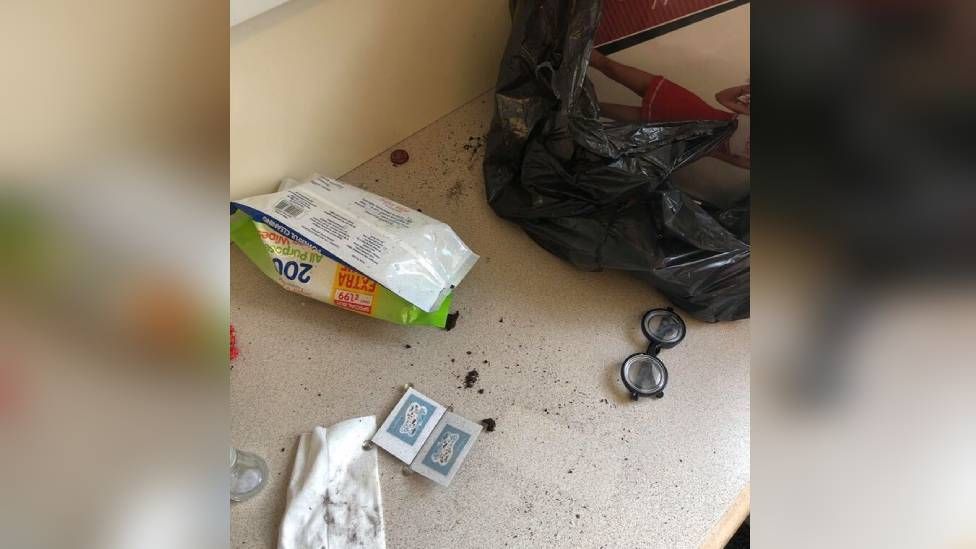
Where is `countertop`? This screenshot has height=549, width=976. countertop is located at coordinates (675, 411).